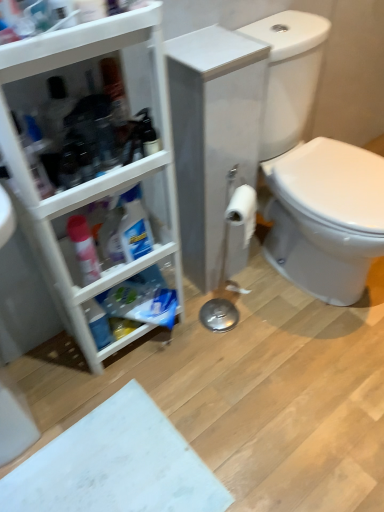
Where is `free space in front of white plastic cabinet at left`? This screenshot has width=384, height=512. free space in front of white plastic cabinet at left is located at coordinates (158, 392).